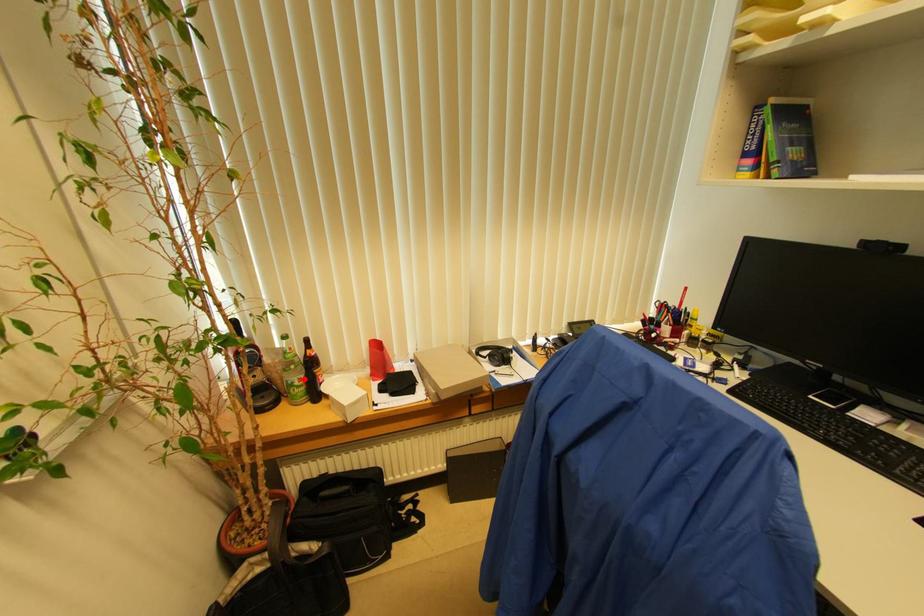
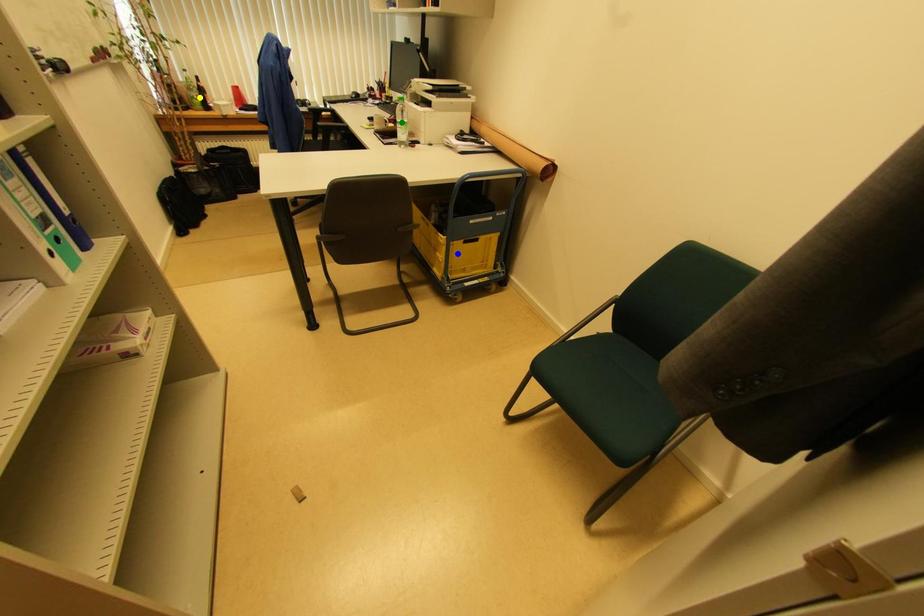
Question: I am providing you with two images of the same scene from different viewpoints. A red point is marked on the first image. You are given multiple points on the second image. Which point in image 2 represents the same 3d spot as the red point in image 1?

Choices:
 (A) green point
 (B) yellow point
 (C) blue point

Answer: (B)